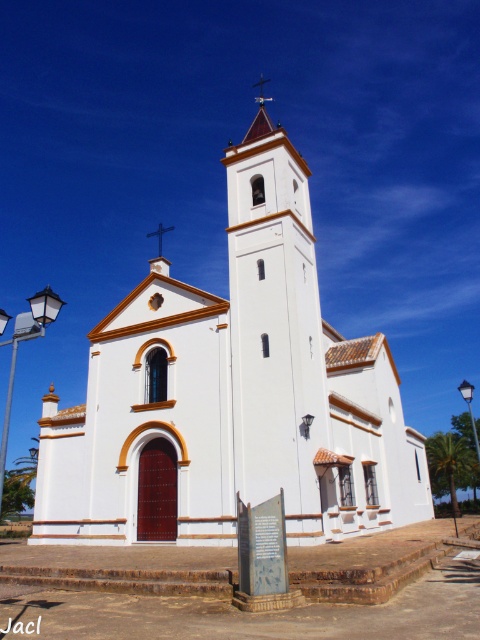
Question: Which of the following is the closest to the observer?

Choices:
 (A) white smooth tower at center
 (B) white matte church at center
 (C) matte black lamppost at left
 (D) black metal cross at upper center

Answer: (C)

Question: Can you confirm if white matte church at center is positioned to the left of white smooth tower at center?

Choices:
 (A) no
 (B) yes

Answer: (B)

Question: Which point is closer to the camera?

Choices:
 (A) matte black lamppost at left
 (B) white smooth tower at center
 (C) black metal cross at upper center

Answer: (A)

Question: Is white matte church at center positioned before metallic streetlight at upper right?

Choices:
 (A) no
 (B) yes

Answer: (B)

Question: Does white matte church at center have a lesser width compared to black metal cross at upper center?

Choices:
 (A) no
 (B) yes

Answer: (A)

Question: Which point is farther from the camera taking this photo?

Choices:
 (A) (300, 429)
 (B) (32, 332)
 (C) (305, 492)
 (D) (476, 428)

Answer: (D)